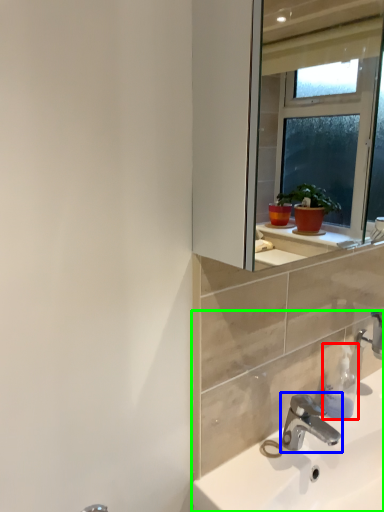
Question: Estimate the real-world distances between objects in this image. Which object is closer to soap dispenser (highlighted by a red box), tap (highlighted by a blue box) or sink (highlighted by a green box)?

Choices:
 (A) tap
 (B) sink

Answer: (A)